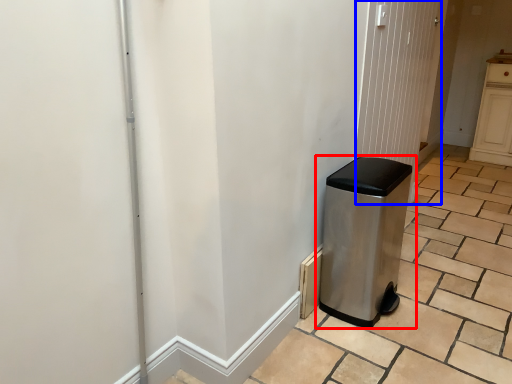
Question: Which of the following is the closest to the observer, waste container (highlighted by a red box) or screen door (highlighted by a blue box)?

Choices:
 (A) waste container
 (B) screen door

Answer: (A)